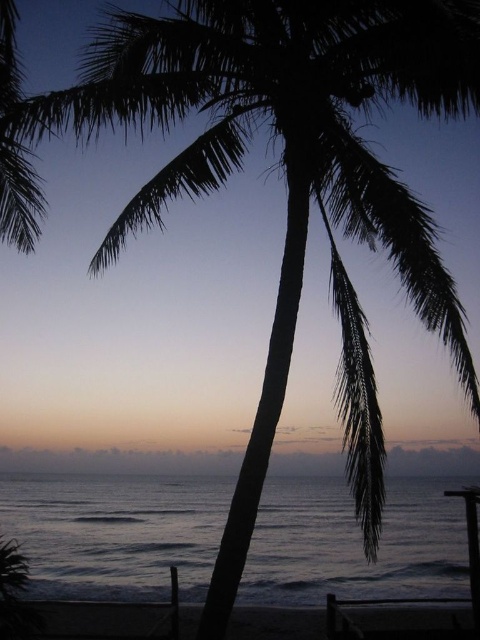
Does dark blue water at lower left have a greater height compared to dark sand at lower center?

No, dark blue water at lower left is not taller than dark sand at lower center.

Where is `dark blue water at lower left`? The width and height of the screenshot is (480, 640). dark blue water at lower left is located at coordinates (116, 532).